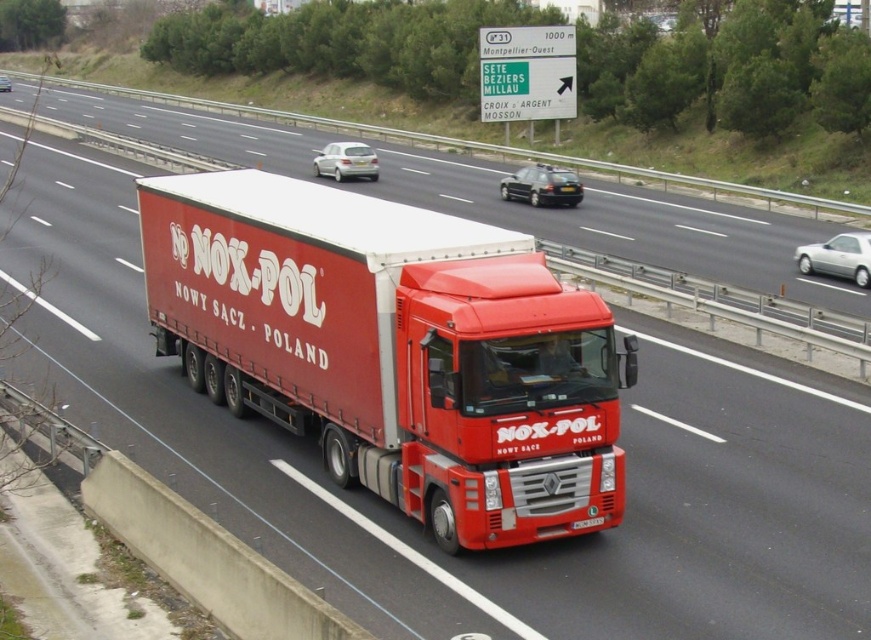
You are a driver in the red truck and you see two silver metallic sedans ahead. Which one is closer to you, the silver metallic sedan at right or the silver metallic sedan at center?

The silver metallic sedan at right is closer to the viewer than the silver metallic sedan at center, so the silver metallic sedan at right is closer to you.